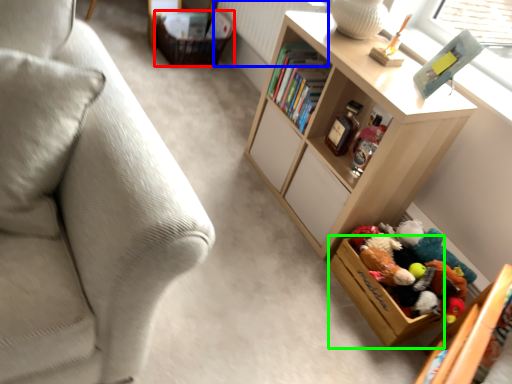
Question: Which object is the closest to the storage box (highlighted by a red box)? Choose among these: radiator (highlighted by a blue box) or storage box (highlighted by a green box).

Choices:
 (A) radiator
 (B) storage box

Answer: (A)